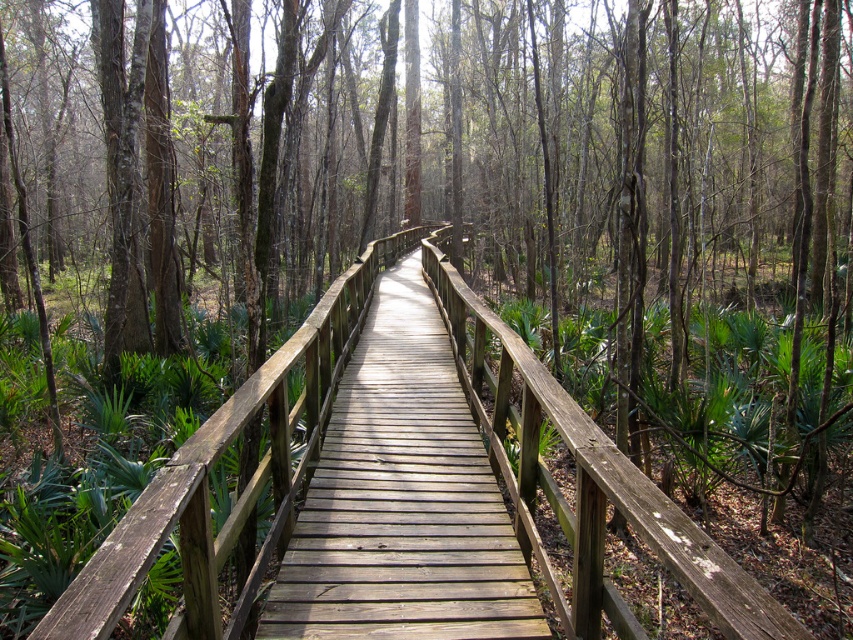
Question: Is natural wood bridge at center to the left of light brown wooden bridge at center from the viewer's perspective?

Choices:
 (A) no
 (B) yes

Answer: (B)

Question: Can you confirm if natural wood bridge at center is wider than light brown wooden bridge at center?

Choices:
 (A) yes
 (B) no

Answer: (A)

Question: Which point is closer to the camera taking this photo?

Choices:
 (A) (459, 538)
 (B) (408, 243)

Answer: (A)

Question: Is natural wood bridge at center bigger than light brown wooden bridge at center?

Choices:
 (A) yes
 (B) no

Answer: (A)

Question: Which point is farther to the camera?

Choices:
 (A) (440, 538)
 (B) (202, 445)

Answer: (A)